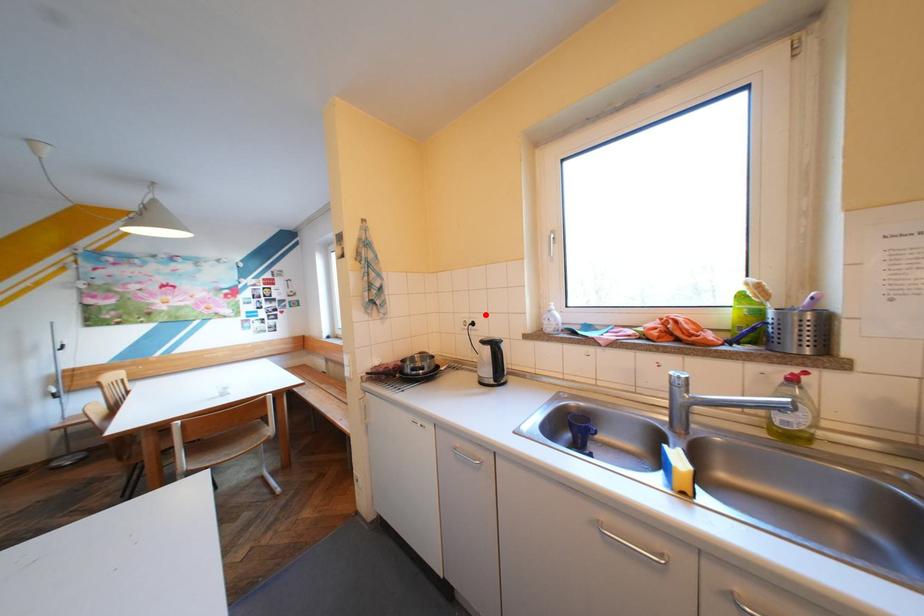
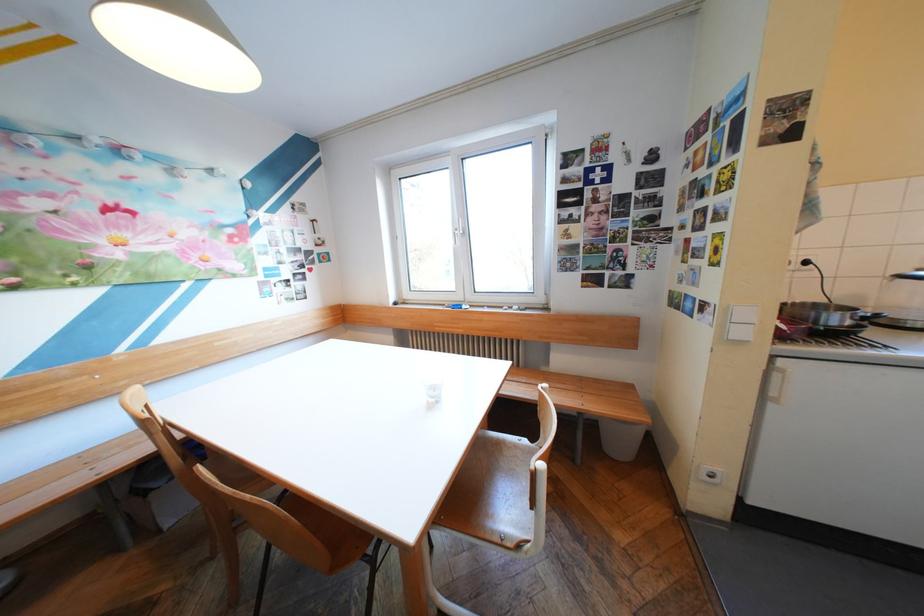
The point at the highlighted location is marked in the first image. Where is the corresponding point in the second image?

(816, 252)